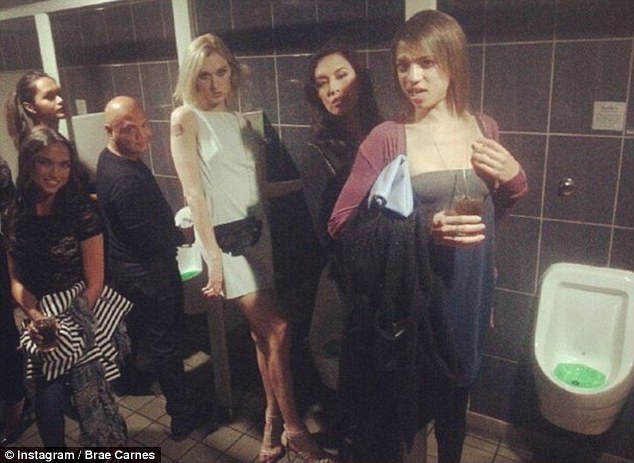
The height and width of the screenshot is (463, 634). I want to click on toilet, so click(x=605, y=292).